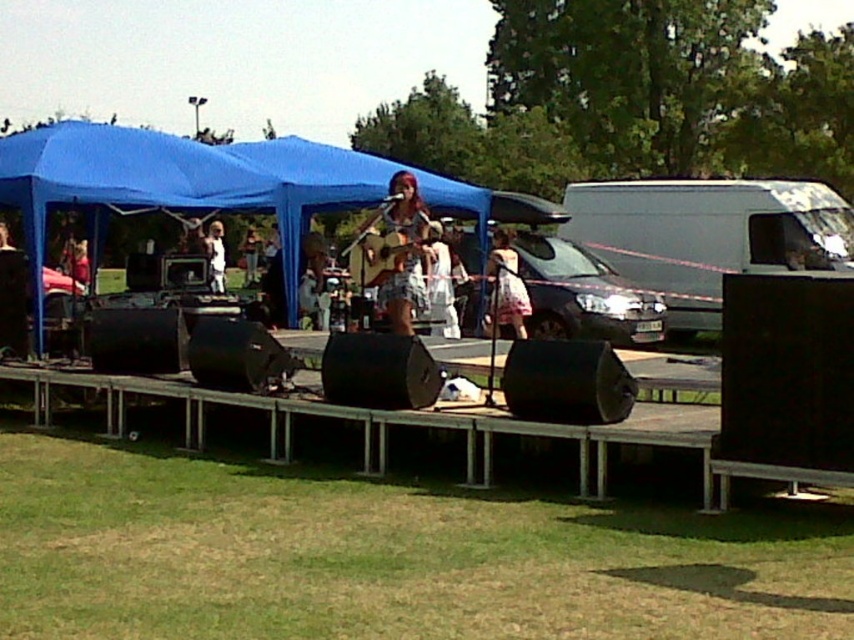
You are standing at the point labeled point (x=221, y=225) and want to walk towards the stage. Is the point labeled point (x=393, y=202) in front of or behind you relative to your direction of movement?

The point labeled point (x=393, y=202) is closer to the viewer than point (x=221, y=225), so when moving towards the stage from point (x=221, y=225), the point (x=393, y=202) would be in front of you along the path towards the stage.

You are a stagehand organizing the equipment for the concert. You need to place the matte brown guitar at center and the white fabric dress at center on a shelf. The shelf has a maximum weight capacity of 20 kilograms. The dress weighs 1.5 kilograms, and the guitar weighs 3 kilograms. Can both items be safely placed on the shelf together?

The matte brown guitar at center weighs 3 kilograms and the white fabric dress at center weighs 1.5 kilograms. Combined, they total 4.5 kilograms, which is well under the 20 kilogram limit. Both items can be safely placed on the shelf together.